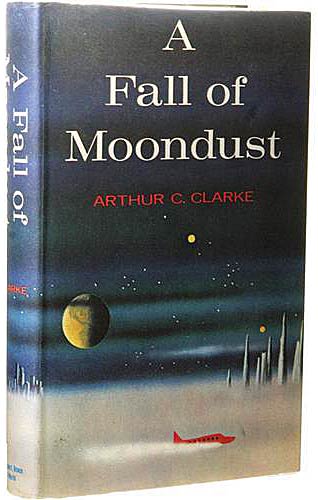
The height and width of the screenshot is (500, 318). What are the coordinates of `spine of book` in the screenshot? It's located at pyautogui.click(x=21, y=329).